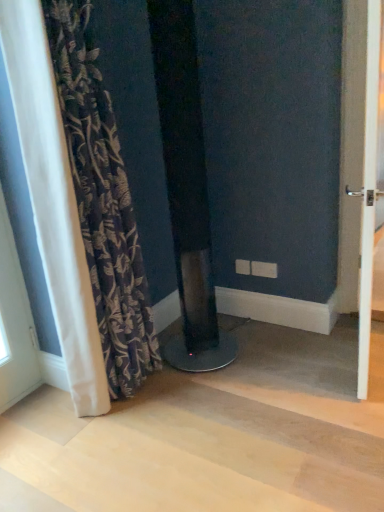
Question: Is white glossy door at right inside the boundaries of dark floral fabric curtain at left, or outside?

Choices:
 (A) outside
 (B) inside

Answer: (A)

Question: Would you say white glossy door at right is to the left or to the right of dark floral fabric curtain at left in the picture?

Choices:
 (A) left
 (B) right

Answer: (B)

Question: Looking at the image, does white glossy door at right seem bigger or smaller compared to dark floral fabric curtain at left?

Choices:
 (A) big
 (B) small

Answer: (B)

Question: Which is correct: dark floral fabric curtain at left is inside white glossy door at right, or outside of it?

Choices:
 (A) inside
 (B) outside

Answer: (B)

Question: Considering the positions of point (112, 242) and point (364, 343), is point (112, 242) closer or farther from the camera than point (364, 343)?

Choices:
 (A) closer
 (B) farther

Answer: (A)

Question: Relative to white glossy door at right, is dark floral fabric curtain at left in front or behind?

Choices:
 (A) behind
 (B) front

Answer: (A)

Question: In terms of width, does dark floral fabric curtain at left look wider or thinner when compared to white glossy door at right?

Choices:
 (A) thin
 (B) wide

Answer: (B)